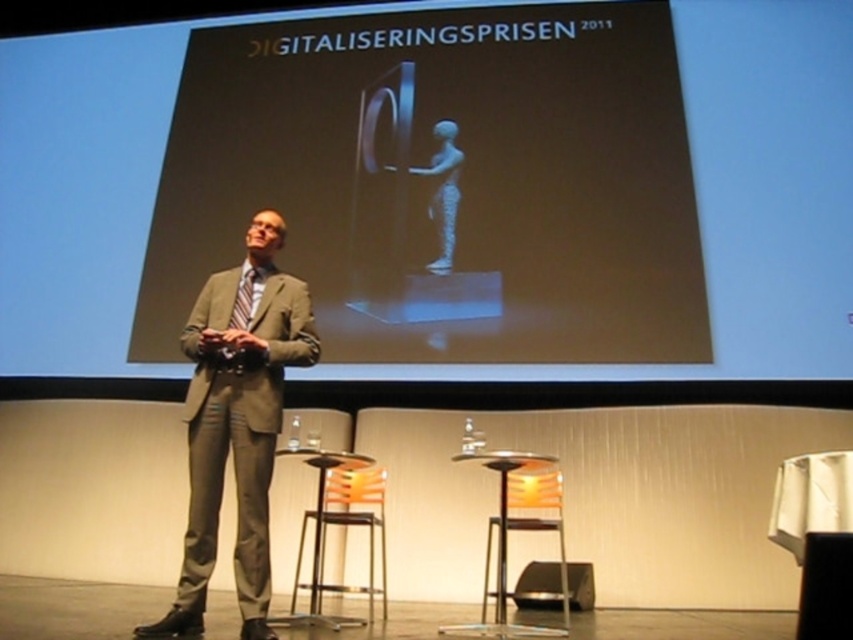
You are an event planner checking the stage setup. You need to ensure that the matte black screen at upper center is positioned so it doesn not block the view of the matte gray suit at center. Based on the current setup, is the screen likely to block the view of the presenter?

The matte black screen at upper center might be wider than the matte gray suit at center, so there is a possibility that the screen could block part of the presenter if they are centered behind it.

You are an event photographer at the Digitalization Prize 2011 ceremony. You want to take a photo of the speaker while ensuring both the striped fabric tie at center and the matte black screen at upper center are clearly visible. Based on their positions, which object is closer to you, the photographer?

The striped fabric tie at center is behind the matte black screen at upper center, so the matte black screen at upper center is closer to you.

Consider the image. Based on the scene description, can you determine which object is located above the other between the matte black screen at upper center and the striped fabric tie at center?

The matte black screen at upper center is positioned over striped fabric tie at center, meaning it is above the tie.